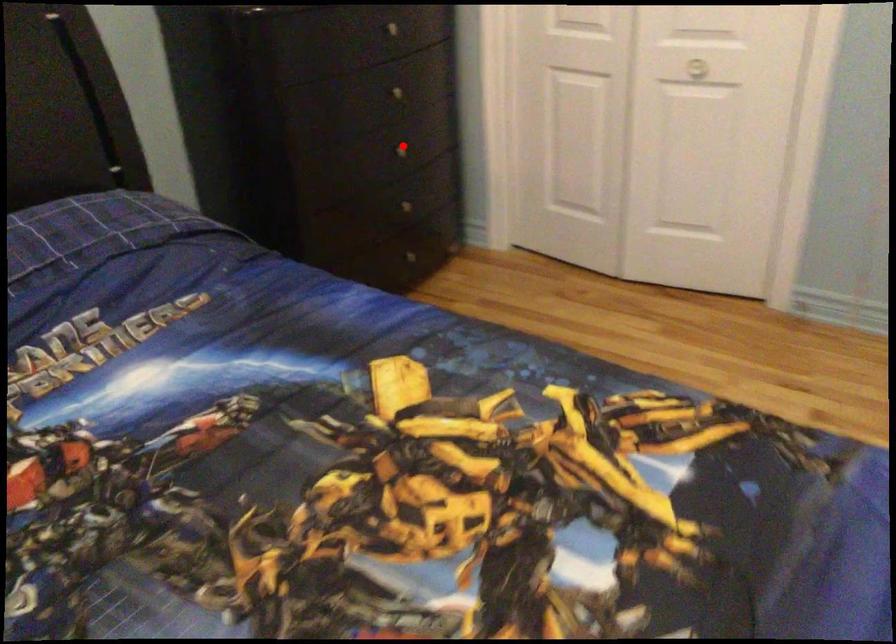
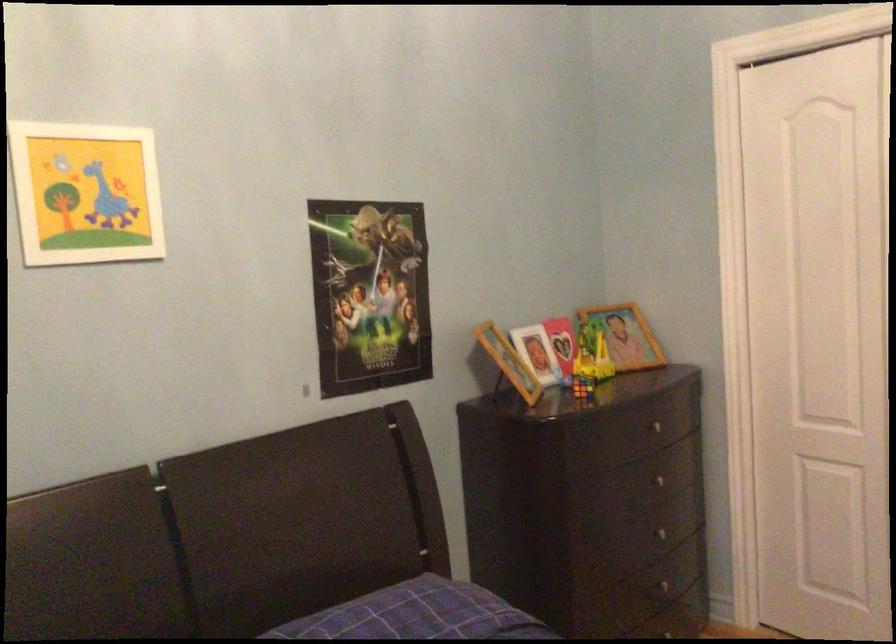
In the second image, find the point that corresponds to the highlighted location in the first image.

(667, 532)